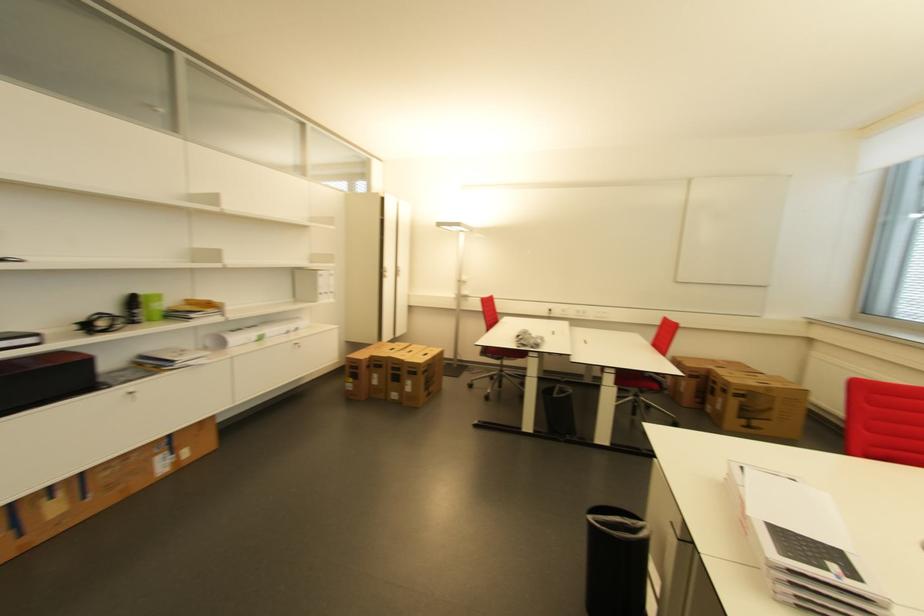
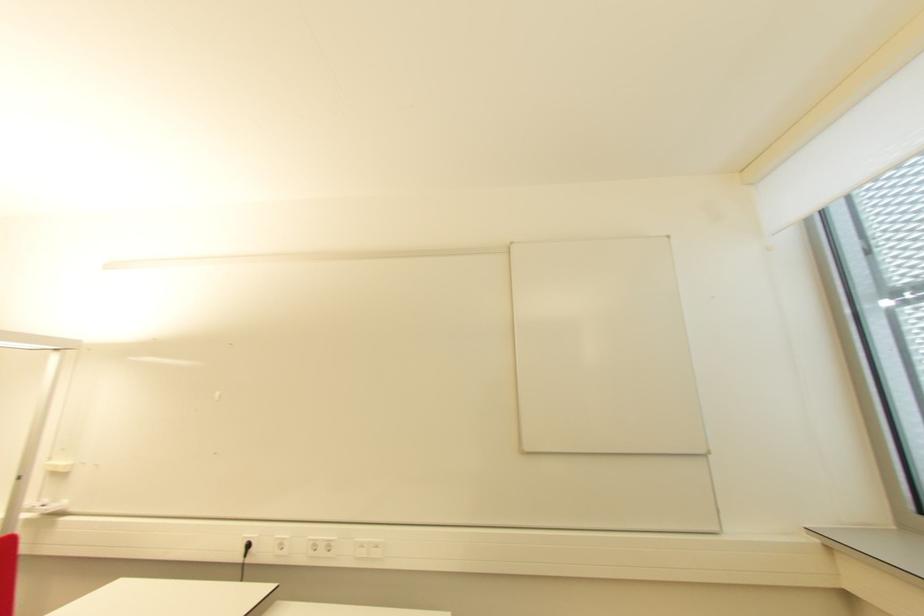
What movement of the cameraman would produce the second image?

The movement direction of the cameraman is right, forward.